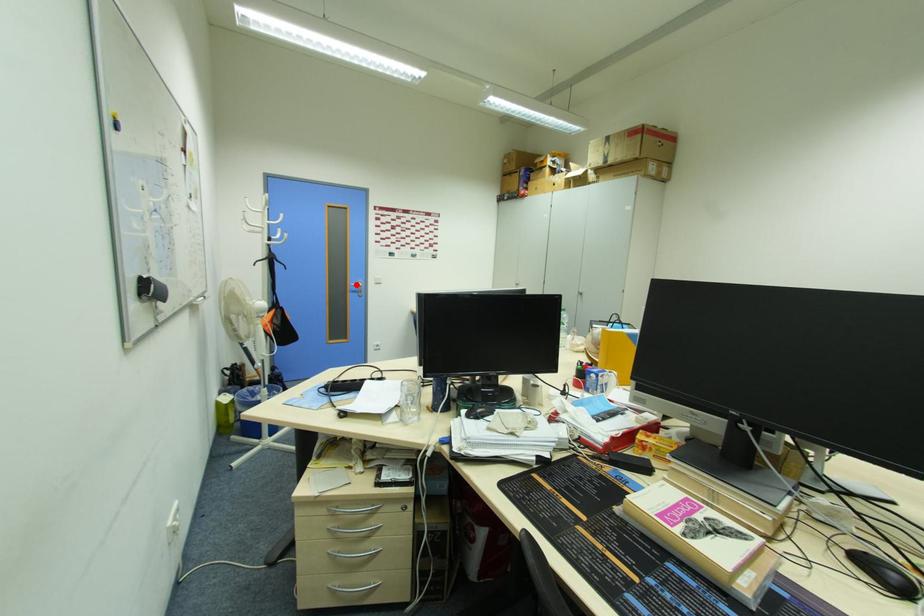
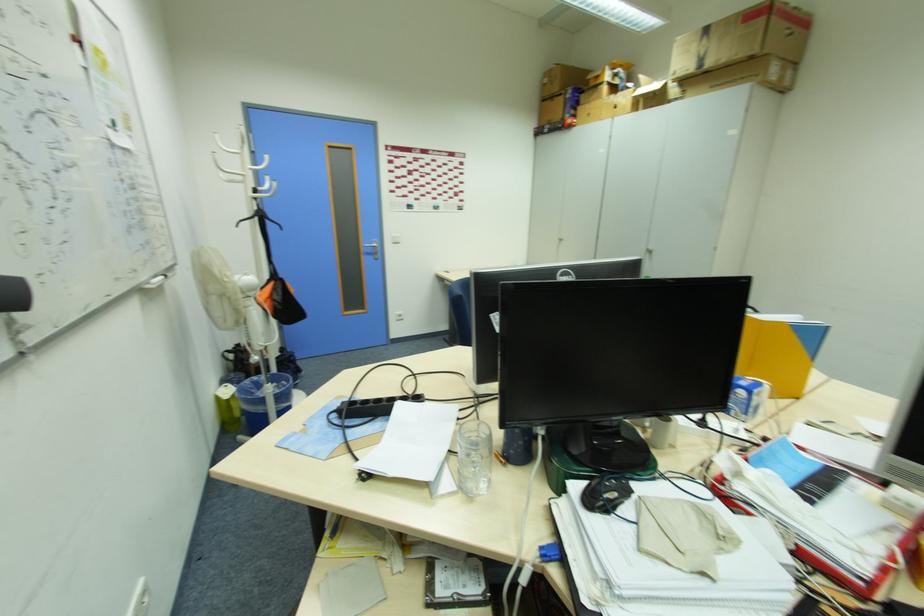
In the second image, find the point that corresponds to the highlighted location in the first image.

(370, 245)